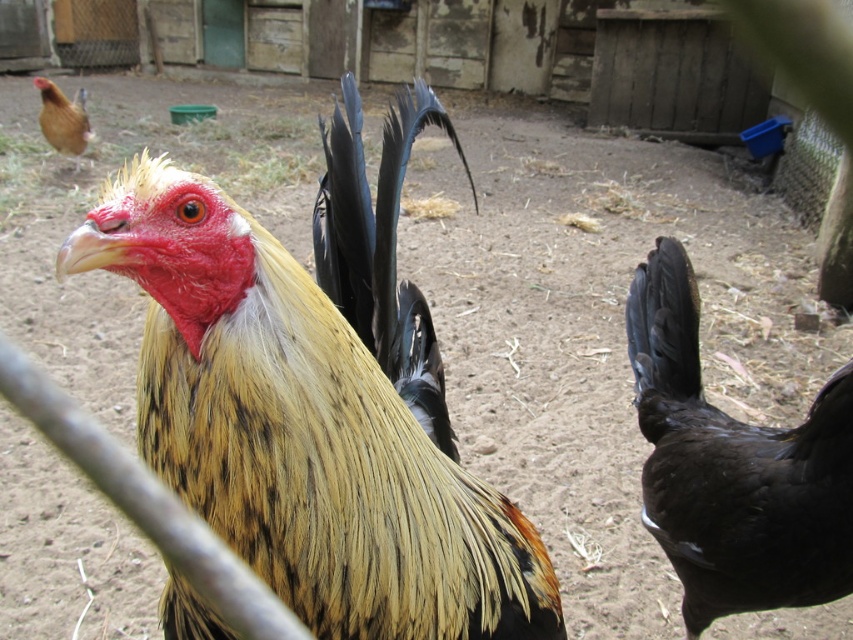
Question: Is golden-yellow feathers at center to the left of brown feathered chicken at upper left from the viewer's perspective?

Choices:
 (A) yes
 (B) no

Answer: (B)

Question: Among these objects, which one is farthest from the camera?

Choices:
 (A) brown feathered chicken at upper left
 (B) golden-yellow feathers at center

Answer: (A)

Question: Does golden-yellow feathers at center have a larger size compared to brown feathered chicken at upper left?

Choices:
 (A) no
 (B) yes

Answer: (B)

Question: Considering the real-world distances, which object is closest to the black glossy feathers at right?

Choices:
 (A) brown feathered chicken at upper left
 (B) golden-yellow feathers at center

Answer: (B)

Question: Which of the following is the closest to the observer?

Choices:
 (A) (53, 141)
 (B) (264, 371)
 (C) (641, 280)

Answer: (B)

Question: Does golden-yellow feathers at center appear over black glossy feathers at right?

Choices:
 (A) no
 (B) yes

Answer: (B)